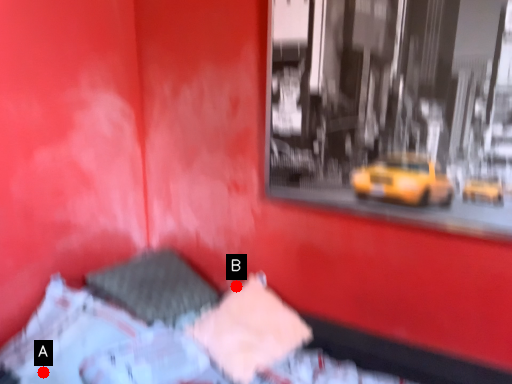
Question: Two points are circled on the image, labeled by A and B beside each circle. Among these points, which one is nearest to the camera?

Choices:
 (A) A is closer
 (B) B is closer

Answer: (A)